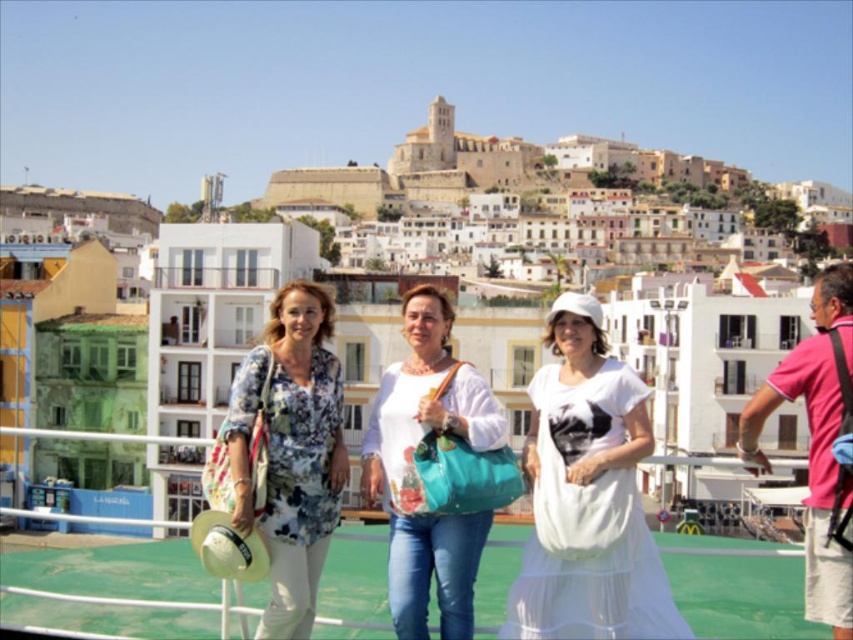
Question: Estimate the real-world distances between objects in this image. Which object is closer to the floral print blouse at center?

Choices:
 (A) white cotton dress at center
 (B) white matte bag at center

Answer: (B)

Question: Does white cotton dress at center appear on the right side of floral print blouse at center?

Choices:
 (A) no
 (B) yes

Answer: (B)

Question: Does floral print blouse at center appear under white matte bag at center?

Choices:
 (A) no
 (B) yes

Answer: (B)

Question: Can you confirm if white cotton dress at center is wider than floral print blouse at center?

Choices:
 (A) yes
 (B) no

Answer: (A)

Question: Which point appears closest to the camera in this image?

Choices:
 (A) (567, 502)
 (B) (822, 316)
 (C) (390, 509)

Answer: (A)

Question: Which point is closer to the camera taking this photo?

Choices:
 (A) (471, 404)
 (B) (326, 401)
 (C) (820, 340)

Answer: (C)